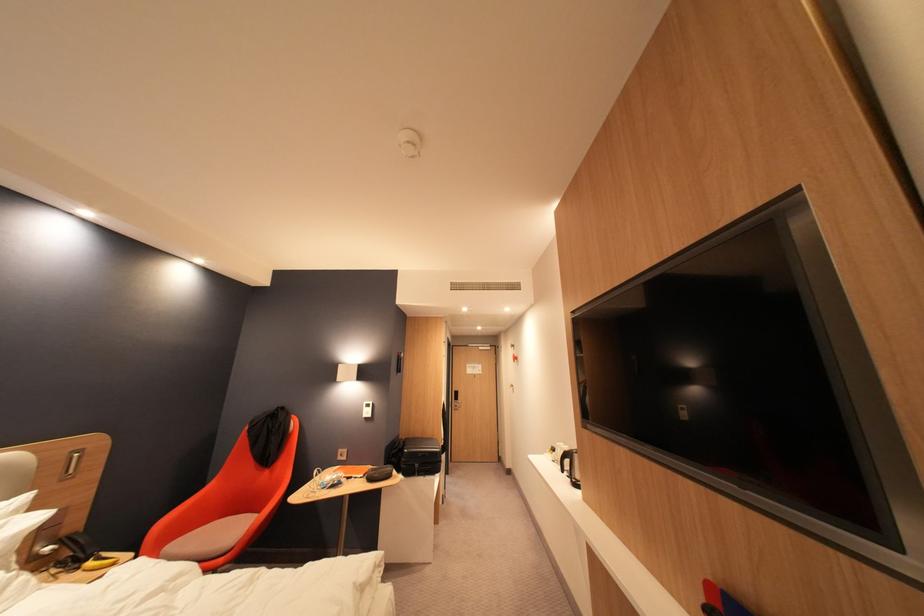
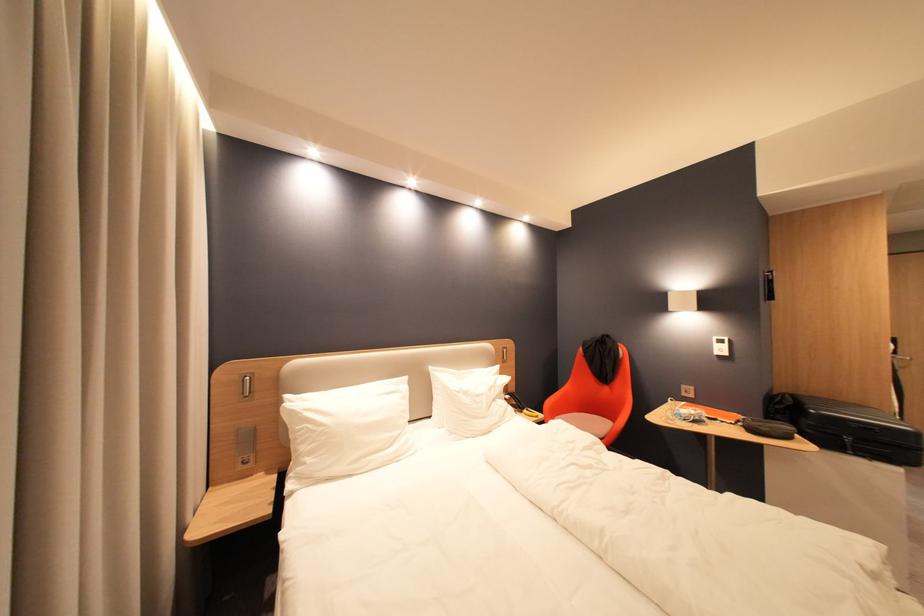
Question: The camera is either moving clockwise (left) or counter-clockwise (right) around the object. The first image is from the beginning of the video and the second image is from the end. Is the camera moving left or right when shooting the video?

Choices:
 (A) Left
 (B) Right

Answer: (B)